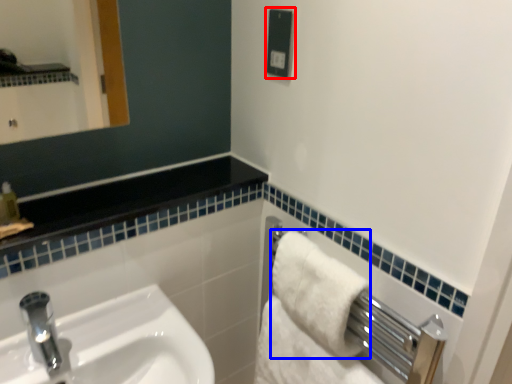
Question: Which object is closer to the camera taking this photo, electric outlet (highlighted by a red box) or bath towel (highlighted by a blue box)?

Choices:
 (A) electric outlet
 (B) bath towel

Answer: (B)